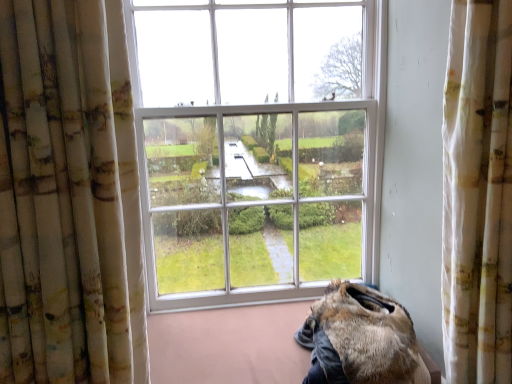
Question: From the image's perspective, does fuzzy brown fur at lower right appear higher than white textured curtain at right, acting as the 1th curtain starting from the right?

Choices:
 (A) no
 (B) yes

Answer: (A)

Question: Considering the relative positions of fuzzy brown fur at lower right and white textured curtain at right, acting as the 1th curtain starting from the right, in the image provided, is fuzzy brown fur at lower right behind white textured curtain at right, acting as the 1th curtain starting from the right,?

Choices:
 (A) no
 (B) yes

Answer: (B)

Question: Does fuzzy brown fur at lower right appear on the right side of white textured curtain at right, acting as the 1th curtain starting from the right?

Choices:
 (A) yes
 (B) no

Answer: (B)

Question: Does fuzzy brown fur at lower right appear on the left side of white textured curtain at right, marked as the second curtain in a left-to-right arrangement?

Choices:
 (A) no
 (B) yes

Answer: (B)

Question: Can white textured curtain at right, marked as the second curtain in a left-to-right arrangement, be found inside fuzzy brown fur at lower right?

Choices:
 (A) yes
 (B) no

Answer: (B)

Question: Is white floral fabric curtain at left, arranged as the 2th curtain when viewed from the right, wider or thinner than fuzzy brown fur at lower right?

Choices:
 (A) wide
 (B) thin

Answer: (B)

Question: From the image's perspective, relative to fuzzy brown fur at lower right, is white floral fabric curtain at left, arranged as the 2th curtain when viewed from the right, above or below?

Choices:
 (A) above
 (B) below

Answer: (A)

Question: Is white floral fabric curtain at left, which is counted as the first curtain, starting from the left, in front of or behind fuzzy brown fur at lower right in the image?

Choices:
 (A) front
 (B) behind

Answer: (A)

Question: Looking at the image, does white floral fabric curtain at left, which is counted as the first curtain, starting from the left, seem bigger or smaller compared to fuzzy brown fur at lower right?

Choices:
 (A) big
 (B) small

Answer: (A)

Question: Is white floral fabric curtain at left, arranged as the 2th curtain when viewed from the right, inside or outside of white textured curtain at right, marked as the second curtain in a left-to-right arrangement?

Choices:
 (A) inside
 (B) outside

Answer: (B)

Question: Is white floral fabric curtain at left, arranged as the 2th curtain when viewed from the right, bigger or smaller than white textured curtain at right, acting as the 1th curtain starting from the right?

Choices:
 (A) big
 (B) small

Answer: (A)

Question: Is white floral fabric curtain at left, which is counted as the first curtain, starting from the left, taller or shorter than white textured curtain at right, acting as the 1th curtain starting from the right?

Choices:
 (A) short
 (B) tall

Answer: (A)

Question: In terms of width, does white floral fabric curtain at left, which is counted as the first curtain, starting from the left, look wider or thinner when compared to white textured curtain at right, acting as the 1th curtain starting from the right?

Choices:
 (A) wide
 (B) thin

Answer: (B)

Question: Is white textured curtain at right, acting as the 1th curtain starting from the right, in front of or behind fuzzy brown fur at lower right in the image?

Choices:
 (A) front
 (B) behind

Answer: (A)

Question: Visually, is white textured curtain at right, marked as the second curtain in a left-to-right arrangement, positioned to the left or to the right of fuzzy brown fur at lower right?

Choices:
 (A) right
 (B) left

Answer: (A)